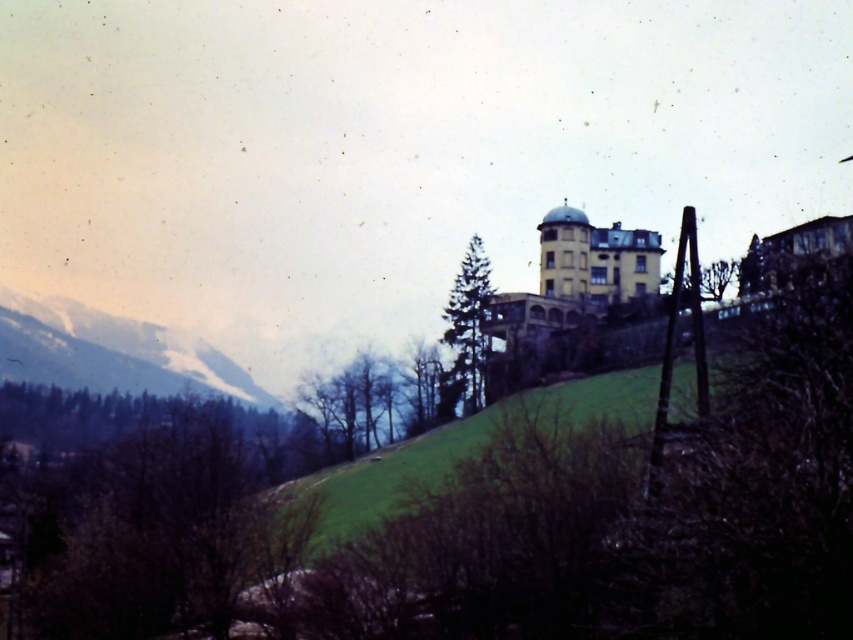
Question: Which point is farther to the camera?

Choices:
 (A) (454, 305)
 (B) (407, 371)
 (C) (76, 369)

Answer: (C)

Question: Can you confirm if green textured tree at center is thinner than green leafy tree at center?

Choices:
 (A) no
 (B) yes

Answer: (A)

Question: Which object is closer to the camera taking this photo?

Choices:
 (A) green textured tree at center
 (B) green leafy tree at center

Answer: (A)

Question: Is snowy rocky mountain at left to the left of green textured tree at center from the viewer's perspective?

Choices:
 (A) yes
 (B) no

Answer: (A)

Question: Which point is farther from the camera taking this photo?

Choices:
 (A) (474, 406)
 (B) (68, 353)
 (C) (415, 342)

Answer: (B)

Question: Is green textured tree at center further to camera compared to green leafy tree at center?

Choices:
 (A) no
 (B) yes

Answer: (A)